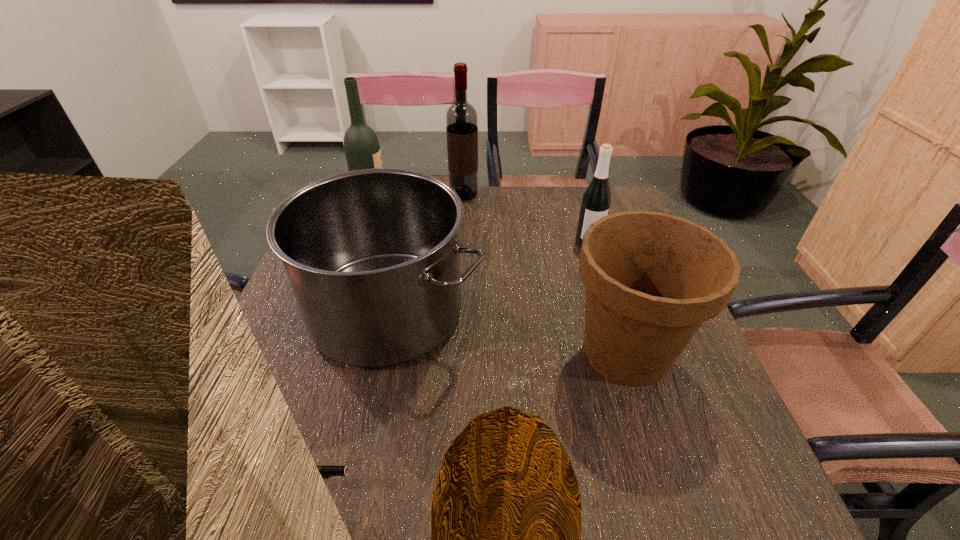
Where is `free space located 0.260m on the label of the nearest wine bottle`? The width and height of the screenshot is (960, 540). free space located 0.260m on the label of the nearest wine bottle is located at coordinates (612, 320).

The height and width of the screenshot is (540, 960). In order to click on vacant space located 0.260m on the front of the saucepan in this screenshot , I will do `click(341, 515)`.

Identify the location of free space located on the back of the flowerpot. This screenshot has height=540, width=960. (586, 224).

At what (x,y) coordinates should I click in order to perform the action: click on vacant space located at the muzzle of the shortest object. Please return your answer as a coordinate pair (x, y). This screenshot has height=540, width=960. Looking at the image, I should click on (509, 491).

At what (x,y) coordinates should I click in order to perform the action: click on object at the near edge. Please return your answer as a coordinate pair (x, y). The image size is (960, 540). Looking at the image, I should click on (326, 471).

You are a GUI agent. You are given a task and a screenshot of the screen. Output one action in this format:
    pyautogui.click(x=<x>, y=<y>)
    Task: Click on the wine bottle present at the left edge
    
    Given the screenshot: What is the action you would take?
    pyautogui.click(x=362, y=150)

Identify the location of saucepan situated at the left edge. (372, 255).

What are the coordinates of `pistol that is at the left edge` in the screenshot? It's located at (326, 471).

Find the location of `wine bottle that is at the right edge`. wine bottle that is at the right edge is located at coordinates (596, 200).

Image resolution: width=960 pixels, height=540 pixels. I want to click on flowerpot that is at the right edge, so click(x=652, y=279).